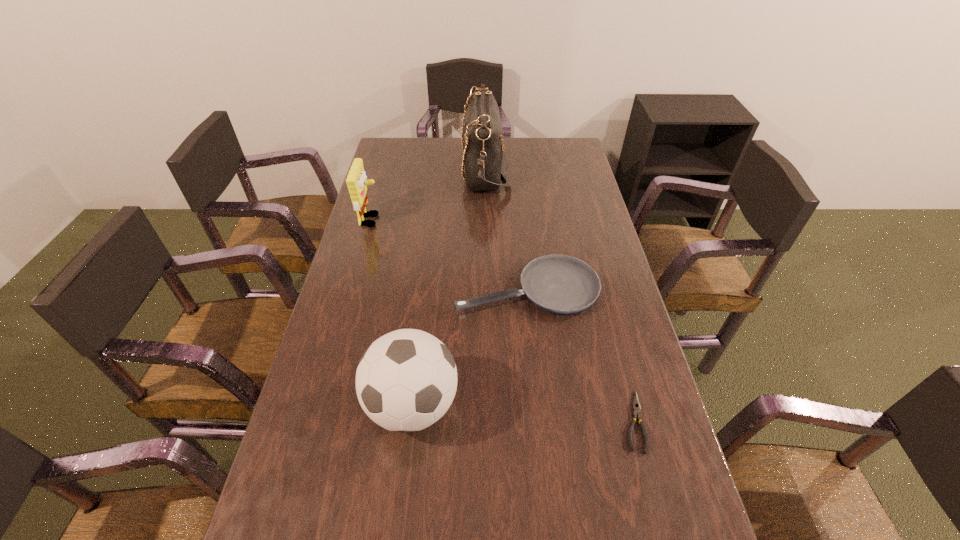
I want to click on handbag, so click(x=485, y=160).

At what (x,y) coordinates should I click in order to perform the action: click on the farthest object. Please return your answer as a coordinate pair (x, y). Looking at the image, I should click on (485, 160).

You are a GUI agent. You are given a task and a screenshot of the screen. Output one action in this format:
    pyautogui.click(x=<x>, y=<y>)
    Task: Click on the soccer ball
    
    Given the screenshot: What is the action you would take?
    pyautogui.click(x=406, y=380)

The height and width of the screenshot is (540, 960). Identify the location of sponge. [x=356, y=181].

The width and height of the screenshot is (960, 540). What are the coordinates of `the second farthest object` in the screenshot? It's located at (356, 181).

The width and height of the screenshot is (960, 540). Find the location of `the second shortest object`. the second shortest object is located at coordinates (561, 284).

You are a GUI agent. You are given a task and a screenshot of the screen. Output one action in this format:
    pyautogui.click(x=<x>, y=<y>)
    Task: Click on the third farthest object
    The image size is (960, 540).
    Given the screenshot: What is the action you would take?
    pyautogui.click(x=561, y=284)

The image size is (960, 540). Identify the location of the shortest object. (636, 406).

Identify the location of free location located 0.180m at the front of the handbag with chain and zipper. (416, 168).

Find the location of a particular element. free space located 0.220m at the front of the handbag with chain and zipper is located at coordinates (406, 168).